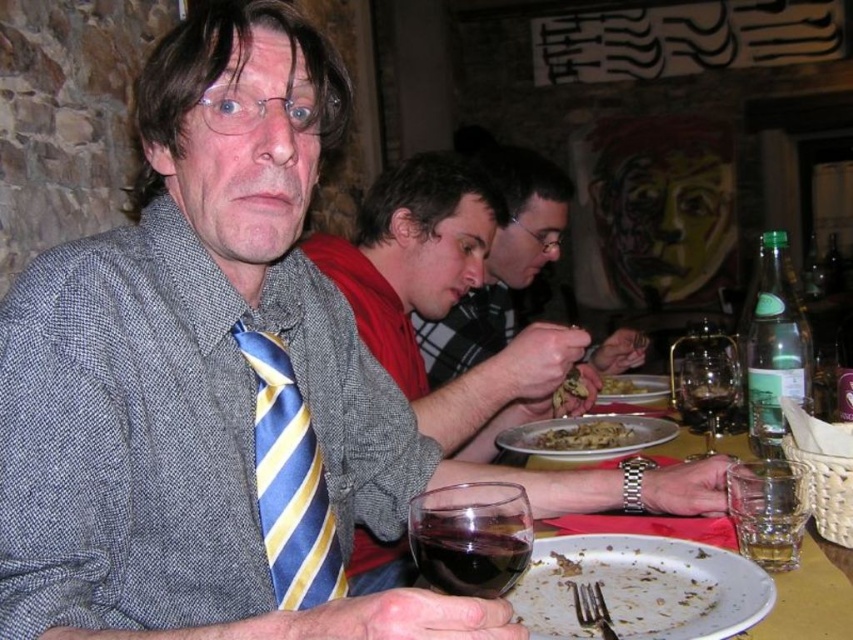
Who is more forward, (492, 556) or (728, 406)?

Point (492, 556) is more forward.

Which is in front, point (416, 529) or point (686, 397)?

Point (416, 529) is more forward.

Locate an element on the screen. This screenshot has height=640, width=853. dark red liquid at lower center is located at coordinates (469, 554).

Looking at this image, does transparent glass wine glass at center have a greater height compared to golden brown pasta at center?

Yes.

Which of these two, transparent glass wine glass at center or golden brown pasta at center, stands taller?

transparent glass wine glass at center

Image resolution: width=853 pixels, height=640 pixels. What do you see at coordinates (708, 388) in the screenshot?
I see `transparent glass wine glass at center` at bounding box center [708, 388].

Where is `transparent glass wine glass at center`? transparent glass wine glass at center is located at coordinates (708, 388).

Is point (552, 396) positioned before point (633, 380)?

Yes, point (552, 396) is closer to viewer.

Does point (573, 396) come in front of point (601, 394)?

Yes, point (573, 396) is in front of point (601, 394).

The width and height of the screenshot is (853, 640). I want to click on brown crumbly bread at center, so click(567, 392).